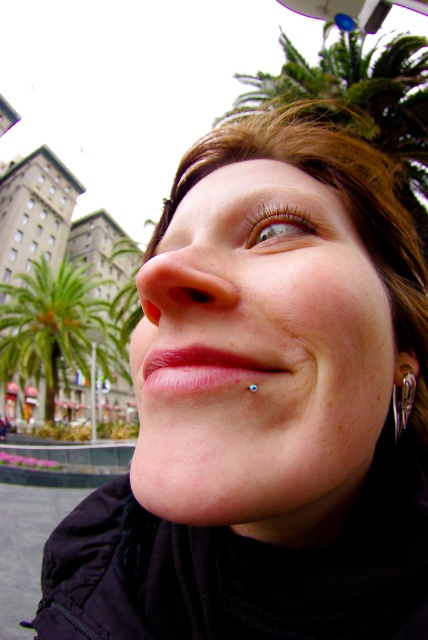
You are a photographer adjusting the focus on your camera. The camera has a grid overlay with coordinates from 0 to 1 on both axes. You want to ensure the smooth skin face at center is perfectly in focus. According to the grid, where should you adjust the focus point to?

The smooth skin face at center is located at point (258,356), so you should adjust the focus point to that coordinate to ensure it is perfectly in focus.

Consider the image. You are a photographer adjusting your camera settings to focus on two points in the image. The first point is at coordinates point [258,282] and the second is at point [397,406]. Which point should you focus on first to ensure the closest object is sharp?

Point [258,282] is closer to the camera than point [397,406], so you should focus on point [258,282] first to ensure the closest object is sharp.